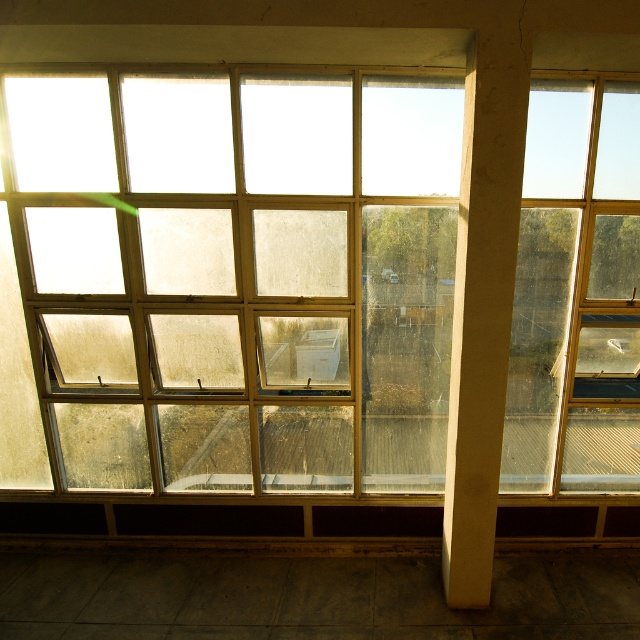
Question: Does clear glass window at center have a smaller size compared to white concrete pillar at center?

Choices:
 (A) yes
 (B) no

Answer: (B)

Question: Does clear glass window at center have a smaller size compared to white concrete pillar at center?

Choices:
 (A) yes
 (B) no

Answer: (B)

Question: Is clear glass window at center positioned behind white concrete pillar at center?

Choices:
 (A) yes
 (B) no

Answer: (A)

Question: Among these objects, which one is farthest from the camera?

Choices:
 (A) clear glass window at center
 (B) white concrete pillar at center

Answer: (A)